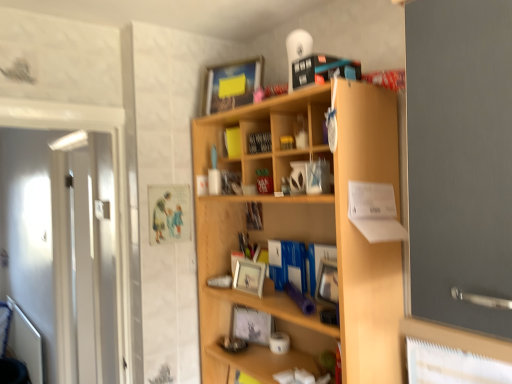
Question: Considering the positions of wooden photo frame at center, which is the 1th book in bottom-to-top order, and yellow matte book at upper center, the third book positioned from the bottom, in the image, is wooden photo frame at center, which is the 1th book in bottom-to-top order, taller or shorter than yellow matte book at upper center, the third book positioned from the bottom,?

Choices:
 (A) short
 (B) tall

Answer: (B)

Question: Would you say wooden photo frame at center, acting as the 3th book starting from the top, is inside or outside yellow matte book at upper center, marked as the first book in a top-to-bottom arrangement?

Choices:
 (A) inside
 (B) outside

Answer: (B)

Question: Which is nearer to the light wood shelf at center?

Choices:
 (A) matte silver picture frame at center, which is the second picture frame from top to bottom
 (B) white glossy door at left
 (C) matte silver picture frame at center, the 3th picture frame when ordered from top to bottom
 (D) black matte bookshelf at center, placed as the 2th book when sorted from bottom to top
 (E) yellow matte book at upper center, arranged as the second book when viewed from the front

Answer: (A)

Question: Which object is positioned closest to the matte silver picture frame at center, placed as the first picture frame when sorted from bottom to top?

Choices:
 (A) matte wooden picture frame at upper center, the first picture frame positioned from the top
 (B) yellow matte book at upper center, marked as the first book in a top-to-bottom arrangement
 (C) matte silver picture frame at center, which is the second picture frame from top to bottom
 (D) wooden photo frame at center, acting as the 3th book starting from the top
 (E) white glossy door at left

Answer: (C)